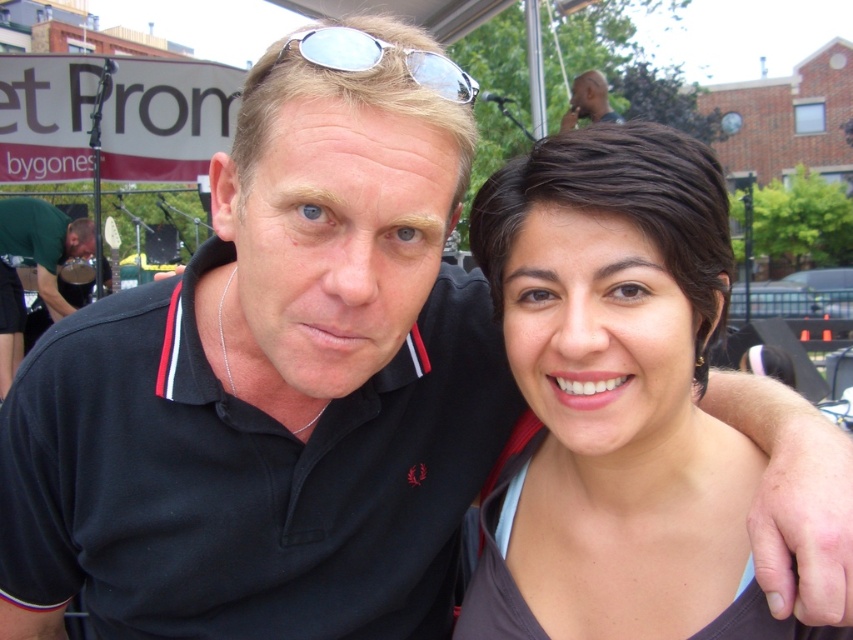
You are a photographer trying to frame a closeup shot of the silver reflective sunglasses at upper center and the smooth skin head at upper center in the image. Since the sunglasses are smaller than the head, which object should you focus on to ensure both fit within the frame?

The silver reflective sunglasses at upper center is smaller than the smooth skin head at upper center, so focusing on the head will ensure both objects fit within the frame.

You are a photographer trying to adjust the lighting for a photo shoot. You notice the silver reflective sunglasses at upper center and the smooth skin head at upper center in the frame. Which object is located to the left of the other?

The silver reflective sunglasses at upper center is positioned on the left side of smooth skin head at upper center.